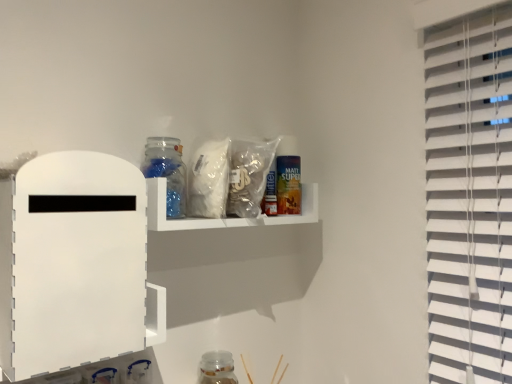
Describe the element at coordinates (223, 218) in the screenshot. Image resolution: width=512 pixels, height=384 pixels. I see `translucent plastic shelf at upper center, the 1th shelf when ordered from back to front` at that location.

This screenshot has height=384, width=512. What do you see at coordinates (230, 178) in the screenshot?
I see `translucent plastic bag at upper center` at bounding box center [230, 178].

This screenshot has width=512, height=384. I want to click on transparent glass jar at lower center, the 2th bottle in the front-to-back sequence, so click(217, 368).

Identify the location of white matte board at left, placed as the first shelf when sorted from front to back. The height and width of the screenshot is (384, 512). (80, 263).

Considering the relative sizes of white matte board at left, placed as the first shelf when sorted from front to back, and transparent glass jar at lower center, which is the 1th bottle in right-to-left order, in the image provided, is white matte board at left, placed as the first shelf when sorted from front to back, smaller than transparent glass jar at lower center, which is the 1th bottle in right-to-left order,?

Actually, white matte board at left, placed as the first shelf when sorted from front to back, might be larger than transparent glass jar at lower center, which is the 1th bottle in right-to-left order.

Looking at this image, between white matte board at left, which is the 2th shelf in back-to-front order, and transparent glass jar at lower center, which is the first bottle from back to front, which one appears on the left side from the viewer's perspective?

white matte board at left, which is the 2th shelf in back-to-front order.

Can you tell me how much white matte board at left, arranged as the first shelf when viewed from the left, and transparent glass jar at lower center, which is the 1th bottle in right-to-left order, differ in facing direction?

white matte board at left, arranged as the first shelf when viewed from the left, and transparent glass jar at lower center, which is the 1th bottle in right-to-left order, are facing 90.2 degrees away from each other.

Which is in front, point (78, 317) or point (205, 354)?

The point (78, 317) is closer.

From a real-world perspective, is translucent plastic shelf at upper center, the second shelf positioned from the front, positioned above or below translucent plastic bag at upper center?

translucent plastic shelf at upper center, the second shelf positioned from the front, is below translucent plastic bag at upper center.

Which is in front, translucent plastic shelf at upper center, the 1th shelf when ordered from back to front, or translucent plastic bag at upper center?

translucent plastic shelf at upper center, the 1th shelf when ordered from back to front, is more forward.

Is translucent plastic shelf at upper center, the 1th shelf when ordered from back to front, looking in the opposite direction of translucent plastic bag at upper center?

Yes.

Can you confirm if white matte board at left, arranged as the first shelf when viewed from the left, is shorter than translucent plastic shelf at upper center, which is the first shelf from right to left?

Incorrect, the height of white matte board at left, arranged as the first shelf when viewed from the left, does not fall short of that of translucent plastic shelf at upper center, which is the first shelf from right to left.

Which object is more forward, white matte board at left, arranged as the first shelf when viewed from the left, or translucent plastic shelf at upper center, marked as the 2th shelf in a left-to-right arrangement?

white matte board at left, arranged as the first shelf when viewed from the left, is in front.

From the image's perspective, is white matte board at left, the second shelf in the right-to-left sequence, above translucent plastic shelf at upper center, which is the first shelf from right to left?

No, from the image's perspective, white matte board at left, the second shelf in the right-to-left sequence, is not above translucent plastic shelf at upper center, which is the first shelf from right to left.

Is translucent plastic shelf at upper center, which is the first shelf from right to left, positioned beyond the bounds of transparent glass jar at lower center, the second bottle viewed from the top?

Yes, translucent plastic shelf at upper center, which is the first shelf from right to left, is not within transparent glass jar at lower center, the second bottle viewed from the top.

How different are the orientations of translucent plastic shelf at upper center, which is the first shelf from right to left, and transparent glass jar at lower center, marked as the second bottle in a left-to-right arrangement, in degrees?

There is a 0.0752-degree angle between the facing directions of translucent plastic shelf at upper center, which is the first shelf from right to left, and transparent glass jar at lower center, marked as the second bottle in a left-to-right arrangement.

Is translucent plastic shelf at upper center, the second shelf positioned from the front, taller than transparent glass jar at lower center, the second bottle viewed from the top?

No, translucent plastic shelf at upper center, the second shelf positioned from the front, is not taller than transparent glass jar at lower center, the second bottle viewed from the top.

Is translucent plastic shelf at upper center, marked as the 2th shelf in a left-to-right arrangement, placed right next to transparent glass jar at lower center, which is the first bottle from back to front?

translucent plastic shelf at upper center, marked as the 2th shelf in a left-to-right arrangement, and transparent glass jar at lower center, which is the first bottle from back to front, are clearly separated.

Considering the relative sizes of translucent plastic bag at upper center and transparent glass jar at upper center, the 1th bottle from the left, in the image provided, is translucent plastic bag at upper center wider than transparent glass jar at upper center, the 1th bottle from the left,?

Yes.

From the picture: From the image's perspective, is translucent plastic bag at upper center positioned above or below transparent glass jar at upper center, which is the second bottle from bottom to top?

Based on their image positions, translucent plastic bag at upper center is located beneath transparent glass jar at upper center, which is the second bottle from bottom to top.

In the scene shown: Is translucent plastic bag at upper center far away from transparent glass jar at upper center, which ranks as the second bottle in right-to-left order?

That's not correct — translucent plastic bag at upper center is a little close to transparent glass jar at upper center, which ranks as the second bottle in right-to-left order.

Measure the distance between translucent plastic bag at upper center and transparent glass jar at upper center, marked as the first bottle in a top-to-bottom arrangement.

The distance of translucent plastic bag at upper center from transparent glass jar at upper center, marked as the first bottle in a top-to-bottom arrangement, is 3.80 inches.

From a real-world perspective, is transparent glass jar at lower center, the 2th bottle in the front-to-back sequence, positioned above or below transparent glass jar at upper center, marked as the first bottle in a top-to-bottom arrangement?

In terms of real-world spatial position, transparent glass jar at lower center, the 2th bottle in the front-to-back sequence, is below transparent glass jar at upper center, marked as the first bottle in a top-to-bottom arrangement.

Which is in front, point (227, 379) or point (178, 179)?

The point (178, 179) is closer to the camera.

Can you tell me how much transparent glass jar at lower center, marked as the second bottle in a left-to-right arrangement, and transparent glass jar at upper center, the 1th bottle viewed from the front, differ in facing direction?

The angle between the facing direction of transparent glass jar at lower center, marked as the second bottle in a left-to-right arrangement, and the facing direction of transparent glass jar at upper center, the 1th bottle viewed from the front, is 0.72 degrees.

Can you confirm if transparent glass jar at lower center, which is the 1th bottle in right-to-left order, is thinner than transparent glass jar at upper center, which ranks as the second bottle in right-to-left order?

No.

Is translucent plastic bag at upper center further to the viewer compared to white matte board at left, placed as the first shelf when sorted from front to back?

Yes, it is.

Choose the correct answer: Is translucent plastic bag at upper center inside white matte board at left, placed as the first shelf when sorted from front to back, or outside it?

translucent plastic bag at upper center exists outside the volume of white matte board at left, placed as the first shelf when sorted from front to back.

Is translucent plastic bag at upper center positioned far away from white matte board at left, which is the 2th shelf in back-to-front order?

translucent plastic bag at upper center is actually quite close to white matte board at left, which is the 2th shelf in back-to-front order.

In terms of height, does translucent plastic bag at upper center look taller or shorter compared to white matte board at left, placed as the first shelf when sorted from front to back?

In the image, translucent plastic bag at upper center appears to be shorter than white matte board at left, placed as the first shelf when sorted from front to back.

Which bottle is the 2nd one when counting from the right side of the white matte board at left, arranged as the first shelf when viewed from the left? Please provide its 2D coordinates.

[(217, 368)]

Where is `shelf that is the 1st object located below the translucent plastic bag at upper center (from the image's perspective)`? The image size is (512, 384). shelf that is the 1st object located below the translucent plastic bag at upper center (from the image's perspective) is located at coordinates (223, 218).

Based on their spatial positions, is white matte board at left, placed as the first shelf when sorted from front to back, or transparent glass jar at lower center, the second bottle viewed from the top, further from transparent glass jar at upper center, marked as the first bottle in a top-to-bottom arrangement?

transparent glass jar at lower center, the second bottle viewed from the top, is further to transparent glass jar at upper center, marked as the first bottle in a top-to-bottom arrangement.

Estimate the real-world distances between objects in this image. Which object is closer to white matte board at left, arranged as the first shelf when viewed from the left, translucent plastic shelf at upper center, the 1th shelf when ordered from back to front, or translucent plastic bag at upper center?

translucent plastic shelf at upper center, the 1th shelf when ordered from back to front, is positioned closer to the anchor white matte board at left, arranged as the first shelf when viewed from the left.

From the image, which object appears to be farther from translucent plastic shelf at upper center, the 1th shelf when ordered from back to front, transparent glass jar at lower center, which is the first bottle from back to front, or translucent plastic bag at upper center?

transparent glass jar at lower center, which is the first bottle from back to front, lies further to translucent plastic shelf at upper center, the 1th shelf when ordered from back to front, than the other object.

Looking at the image, which one is located closer to white matte board at left, the second shelf in the right-to-left sequence, translucent plastic bag at upper center or transparent glass jar at upper center, marked as the first bottle in a top-to-bottom arrangement?

transparent glass jar at upper center, marked as the first bottle in a top-to-bottom arrangement, is closer to white matte board at left, the second shelf in the right-to-left sequence.

Estimate the real-world distances between objects in this image. Which object is further from translucent plastic bag at upper center, transparent glass jar at lower center, which is the 1th bottle in right-to-left order, or transparent glass jar at upper center, which ranks as the second bottle in right-to-left order?

Among the two, transparent glass jar at lower center, which is the 1th bottle in right-to-left order, is located further to translucent plastic bag at upper center.

Considering their positions, is transparent glass jar at lower center, which is the 1th bottle from bottom to top, positioned further to translucent plastic shelf at upper center, marked as the 2th shelf in a left-to-right arrangement, than white matte board at left, the second shelf in the right-to-left sequence?

Among the two, transparent glass jar at lower center, which is the 1th bottle from bottom to top, is located further to translucent plastic shelf at upper center, marked as the 2th shelf in a left-to-right arrangement.

Looking at the image, which one is located further to translucent plastic bag at upper center, translucent plastic shelf at upper center, which is the first shelf from right to left, or white matte board at left, placed as the first shelf when sorted from front to back?

Among the two, white matte board at left, placed as the first shelf when sorted from front to back, is located further to translucent plastic bag at upper center.

Based on their spatial positions, is transparent glass jar at upper center, marked as the first bottle in a top-to-bottom arrangement, or translucent plastic bag at upper center closer to translucent plastic shelf at upper center, marked as the 2th shelf in a left-to-right arrangement?

translucent plastic bag at upper center is closer to translucent plastic shelf at upper center, marked as the 2th shelf in a left-to-right arrangement.

In order to click on food between white matte board at left, arranged as the first shelf when viewed from the left, and transparent glass jar at upper center, which is the second bottle from bottom to top, from front to back in this screenshot , I will do `click(230, 178)`.

Identify the location of food that lies between transparent glass jar at upper center, which is the second bottle from bottom to top, and transparent glass jar at lower center, which is the first bottle from back to front, from top to bottom. (230, 178).

The height and width of the screenshot is (384, 512). In order to click on shelf between translucent plastic shelf at upper center, the second shelf positioned from the front, and transparent glass jar at lower center, marked as the second bottle in a left-to-right arrangement, vertically in this screenshot , I will do `click(80, 263)`.

Locate an element on the screen. This screenshot has height=384, width=512. shelf between white matte board at left, arranged as the first shelf when viewed from the left, and transparent glass jar at upper center, the 1th bottle viewed from the front, along the z-axis is located at coordinates (223, 218).